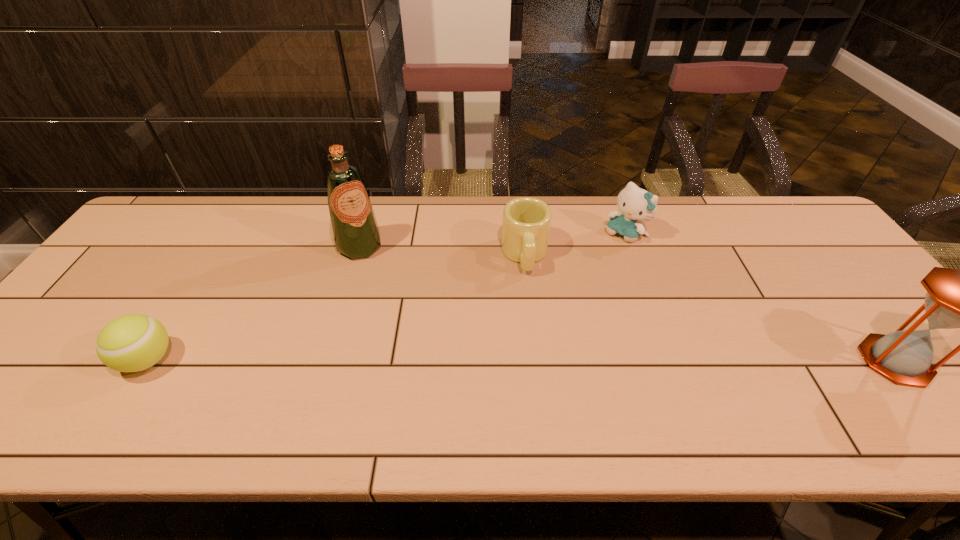
Where is `vacant region at the far right corner`? This screenshot has width=960, height=540. vacant region at the far right corner is located at coordinates (820, 241).

Locate an element on the screen. vacant area that lies between the fourth object from right to left and the mug is located at coordinates (443, 251).

Image resolution: width=960 pixels, height=540 pixels. What are the coordinates of `unoccupied position between the tallest object and the rightmost object` in the screenshot? It's located at (628, 303).

At what (x,y) coordinates should I click in order to perform the action: click on vacant area that lies between the hourglass and the olive oil. Please return your answer as a coordinate pair (x, y). Looking at the image, I should click on 628,303.

Where is `free spot between the leftmost object and the third object from right to left`? The width and height of the screenshot is (960, 540). free spot between the leftmost object and the third object from right to left is located at coordinates (337, 307).

Where is `free space between the third shortest object and the third object from right to left`? free space between the third shortest object and the third object from right to left is located at coordinates (576, 245).

Locate an element on the screen. The image size is (960, 540). vacant region between the olive oil and the mug is located at coordinates (443, 251).

Where is `empty space between the olive oil and the rightmost object`? This screenshot has width=960, height=540. empty space between the olive oil and the rightmost object is located at coordinates (628, 303).

I want to click on vacant space that is in between the third object from left to right and the fourth object from right to left, so pyautogui.click(x=443, y=251).

Where is `free space between the third object from left to right and the fourth object from left to right`? The image size is (960, 540). free space between the third object from left to right and the fourth object from left to right is located at coordinates (576, 245).